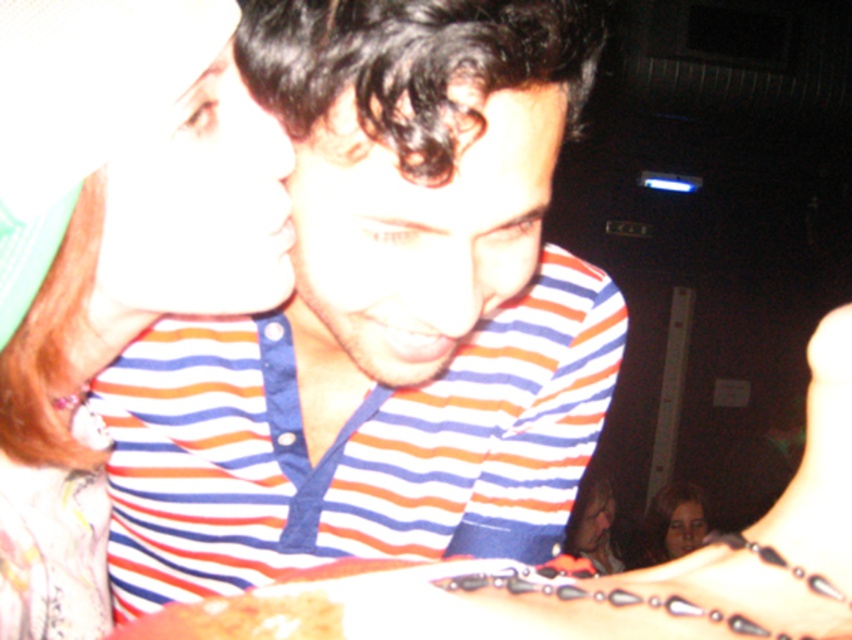
Question: Among these objects, which one is farthest from the camera?

Choices:
 (A) matte striped shirt at upper left
 (B) matte black hair at lower right

Answer: (B)

Question: Considering the relative positions of striped fabric shirt at center and smooth skin face at lower right in the image provided, where is striped fabric shirt at center located with respect to smooth skin face at lower right?

Choices:
 (A) above
 (B) below

Answer: (A)

Question: Which point is farther to the camera?

Choices:
 (A) matte striped shirt at upper left
 (B) striped fabric shirt at center

Answer: (A)

Question: Which point appears closest to the camera in this image?

Choices:
 (A) click(x=321, y=598)
 (B) click(x=684, y=540)
 (C) click(x=229, y=285)
 (D) click(x=121, y=394)

Answer: (A)

Question: In this image, where is striped fabric shirt at center located relative to smooth skin face at lower right?

Choices:
 (A) above
 (B) below

Answer: (A)

Question: Is brown crumbly bread at lower left smaller than matte black hair at lower right?

Choices:
 (A) yes
 (B) no

Answer: (A)